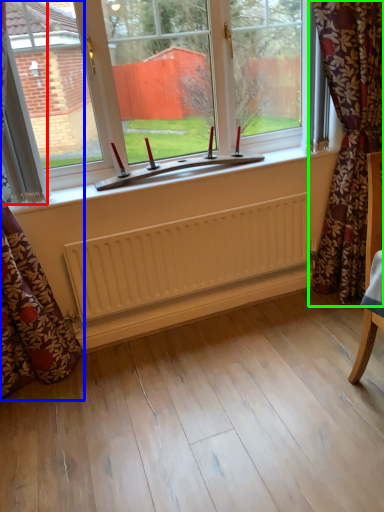
Question: Which is farther away from curtain (highlighted by a red box)? curtain (highlighted by a blue box) or curtain (highlighted by a green box)?

Choices:
 (A) curtain
 (B) curtain

Answer: (B)